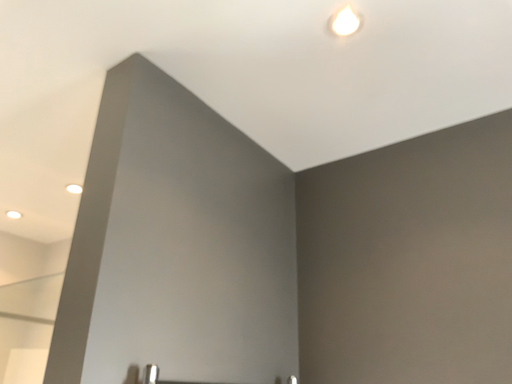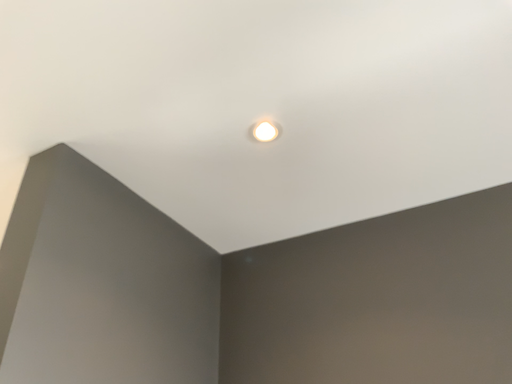
Question: Which way did the camera rotate in the video?

Choices:
 (A) rotated left
 (B) rotated right

Answer: (B)